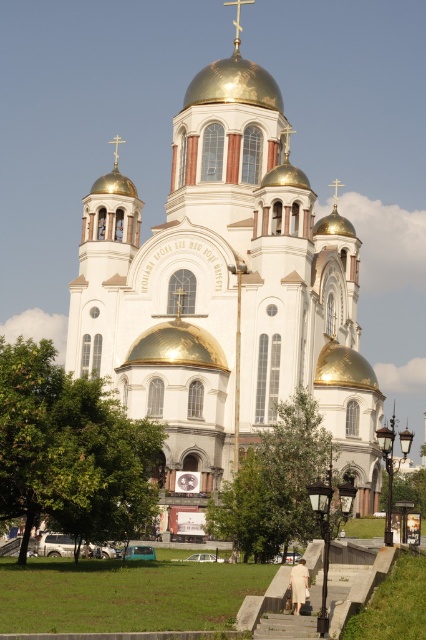
You are an architect designing a model of the church. You have two domes labeled as gold polished dome at center and gold metallic dome at center. Which dome should you make larger in your model to accurately represent the church?

You should make the gold polished dome at center larger than the gold metallic dome at center because the gold polished dome at center has a larger width according to the description.